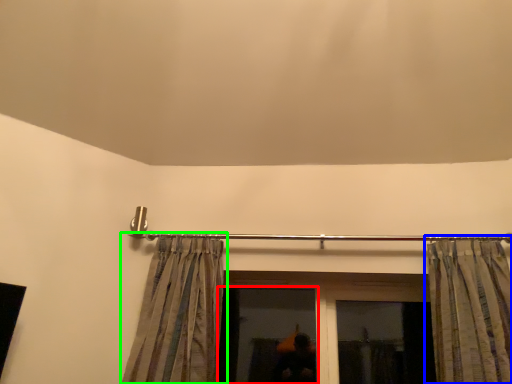
Question: Based on their relative distances, which object is farther from window (highlighted by a red box)? Choose from curtain (highlighted by a blue box) and curtain (highlighted by a green box).

Choices:
 (A) curtain
 (B) curtain

Answer: (A)